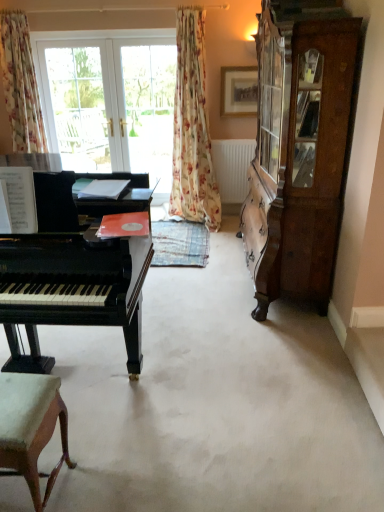
Where is `empty space that is ontop of light brown wood chair at lower left (from a real-world perspective)`? The width and height of the screenshot is (384, 512). empty space that is ontop of light brown wood chair at lower left (from a real-world perspective) is located at coordinates (13, 399).